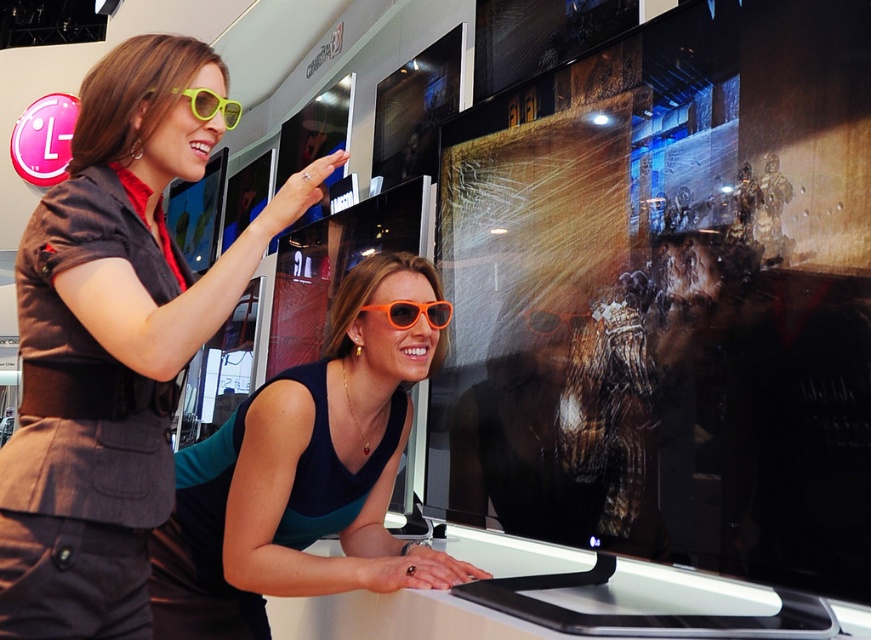
What do you see at coordinates (304, 474) in the screenshot?
I see `orange matte sunglasses at center` at bounding box center [304, 474].

Does orange matte sunglasses at center have a smaller size compared to orange plastic sunglasses at center?

Incorrect, orange matte sunglasses at center is not smaller in size than orange plastic sunglasses at center.

At what (x,y) coordinates should I click in order to perform the action: click on orange matte sunglasses at center. Please return your answer as a coordinate pair (x, y). The height and width of the screenshot is (640, 871). Looking at the image, I should click on (304, 474).

I want to click on orange matte sunglasses at center, so click(x=304, y=474).

Locate an element on the screen. The image size is (871, 640). matte black jacket at upper left is located at coordinates (113, 342).

Does matte black jacket at upper left have a larger size compared to orange plastic sunglasses at center?

Correct, matte black jacket at upper left is larger in size than orange plastic sunglasses at center.

Locate an element on the screen. This screenshot has height=640, width=871. matte black jacket at upper left is located at coordinates [113, 342].

Locate an element on the screen. matte black jacket at upper left is located at coordinates (113, 342).

Describe the element at coordinates (113, 342) in the screenshot. This screenshot has width=871, height=640. I see `matte black jacket at upper left` at that location.

You are a GUI agent. You are given a task and a screenshot of the screen. Output one action in this format:
    pyautogui.click(x=<x>, y=<y>)
    Task: Click on the matte black jacket at upper left
    
    Given the screenshot: What is the action you would take?
    pyautogui.click(x=113, y=342)

I want to click on matte black jacket at upper left, so click(x=113, y=342).